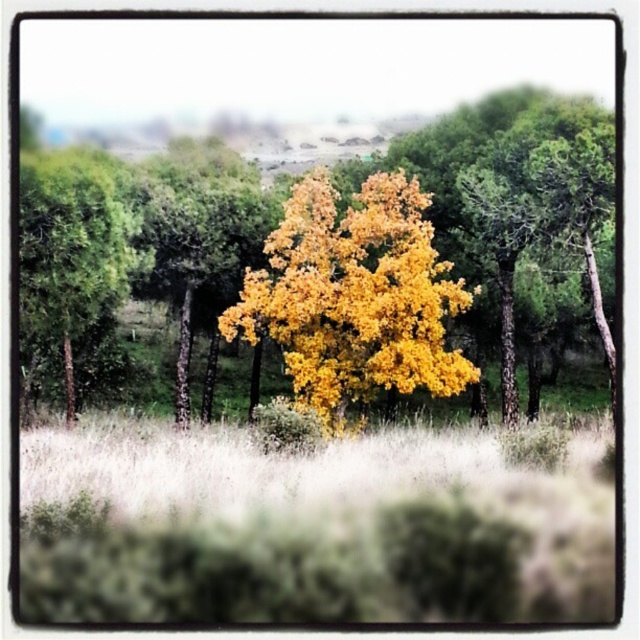
Who is positioned more to the right, golden yellow leaves at center or green matte tree at left?

From the viewer's perspective, golden yellow leaves at center appears more on the right side.

Who is higher up, golden yellow leaves at center or green matte tree at left?

green matte tree at left

Who is more forward, (342, 371) or (49, 292)?

Positioned in front is point (49, 292).

What are the coordinates of `golden yellow leaves at center` in the screenshot? It's located at (355, 296).

Who is positioned more to the right, yellow leafy tree at center or green matte tree at left?

yellow leafy tree at center

Does yellow leafy tree at center appear on the left side of green matte tree at left?

In fact, yellow leafy tree at center is to the right of green matte tree at left.

Locate an element on the screen. This screenshot has width=640, height=640. yellow leafy tree at center is located at coordinates (513, 227).

Between yellow leafy tree at center and golden yellow leaves at center, which one is positioned lower?

golden yellow leaves at center is below.

Between point (506, 252) and point (433, 339), which one is positioned behind?

The point (506, 252) is behind.

Does point (488, 166) come farther from viewer compared to point (266, 241)?

That is True.

This screenshot has height=640, width=640. Identify the location of yellow leafy tree at center. point(513,227).